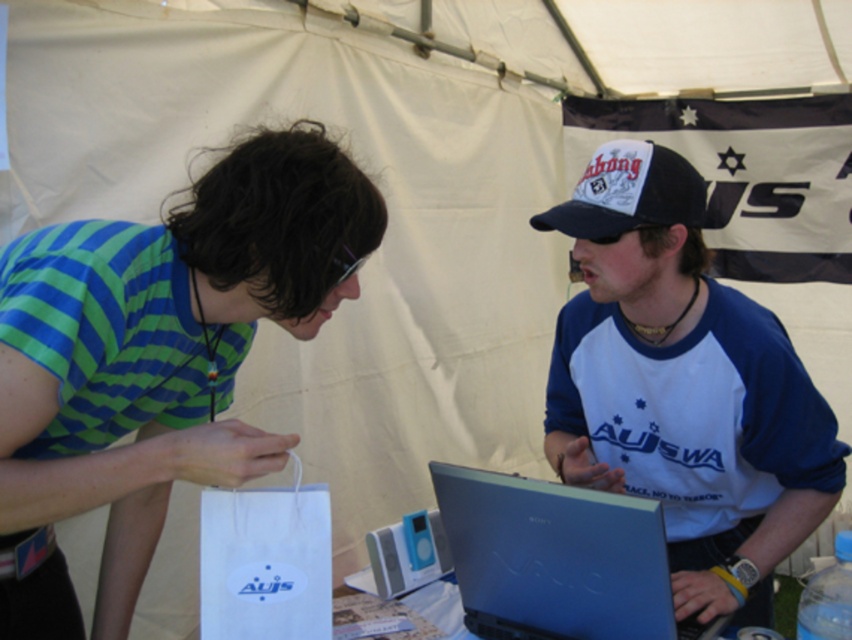
Question: Which point is closer to the camera taking this photo?

Choices:
 (A) (590, 611)
 (B) (781, 538)
 (C) (56, 467)

Answer: (C)

Question: Estimate the real-world distances between objects in this image. Which object is closer to the matte blue laptop at center?

Choices:
 (A) sleek blue laptop at center
 (B) black fabric baseball cap at upper right
 (C) green striped shirt at left

Answer: (A)

Question: Can you confirm if green striped shirt at left is wider than matte blue laptop at center?

Choices:
 (A) no
 (B) yes

Answer: (B)

Question: Does green striped shirt at left have a smaller size compared to sleek blue laptop at center?

Choices:
 (A) no
 (B) yes

Answer: (A)

Question: Which of the following is the closest to the observer?

Choices:
 (A) matte blue laptop at center
 (B) green striped shirt at left
 (C) black fabric baseball cap at upper right

Answer: (B)

Question: Does green striped shirt at left come behind black fabric baseball cap at upper right?

Choices:
 (A) no
 (B) yes

Answer: (A)